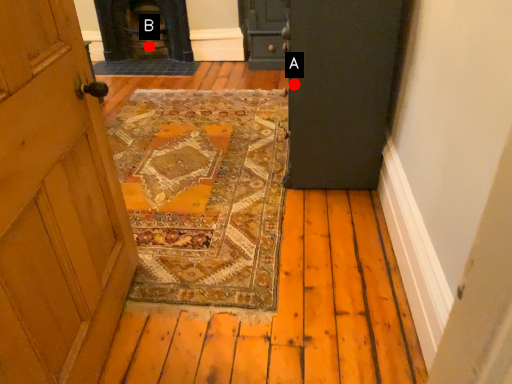
Question: Two points are circled on the image, labeled by A and B beside each circle. Among these points, which one is nearest to the camera?

Choices:
 (A) A is closer
 (B) B is closer

Answer: (A)